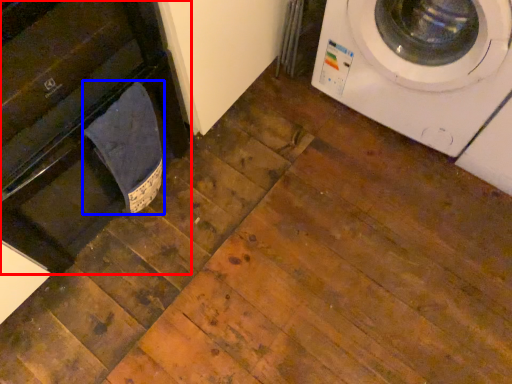
Question: Among these objects, which one is nearest to the camera, dish washer (highlighted by a red box) or laundry (highlighted by a blue box)?

Choices:
 (A) dish washer
 (B) laundry

Answer: (A)